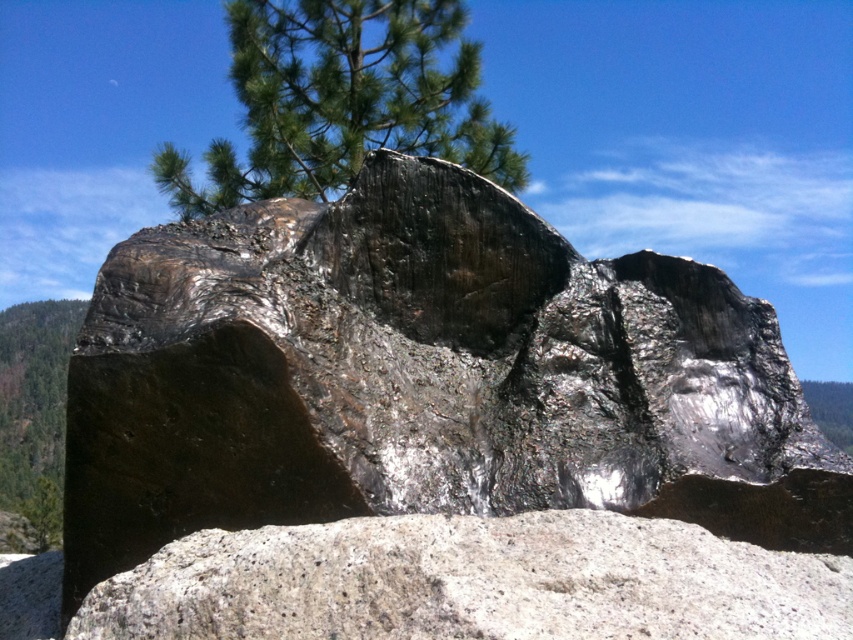
Question: Which point appears farthest from the camera in this image?

Choices:
 (A) (122, 460)
 (B) (281, 20)

Answer: (B)

Question: Where is shiny metallic rock at center located in relation to green matte tree at lower left in the image?

Choices:
 (A) above
 (B) below

Answer: (A)

Question: Is shiny metallic rock at center wider than green textured pine tree at upper center?

Choices:
 (A) no
 (B) yes

Answer: (A)

Question: Which point is closer to the camera?

Choices:
 (A) (76, 314)
 (B) (448, 426)

Answer: (B)

Question: Is shiny metallic rock at center to the left of green matte tree at lower left from the viewer's perspective?

Choices:
 (A) no
 (B) yes

Answer: (A)

Question: Considering the real-world distances, which object is farthest from the green textured pine tree at upper center?

Choices:
 (A) green matte tree at lower left
 (B) shiny metallic rock at center

Answer: (B)